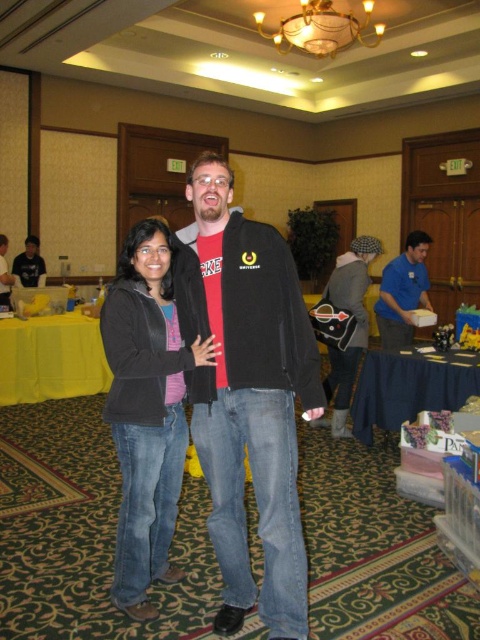
Question: Considering the relative positions of blue shirt at center and matte black jacket at center in the image provided, where is blue shirt at center located with respect to matte black jacket at center?

Choices:
 (A) right
 (B) left

Answer: (A)

Question: Which of the following is the farthest from the observer?

Choices:
 (A) (4, 241)
 (B) (143, 296)
 (C) (24, 371)

Answer: (A)

Question: Among these objects, which one is nearest to the camera?

Choices:
 (A) yellow fabric table at left
 (B) matte black jacket at left
 (C) matte black jacket at center

Answer: (A)

Question: Considering the real-world distances, which object is farthest from the blue shirt at center?

Choices:
 (A) matte black jacket at center
 (B) black matte jacket at center
 (C) black soft jacket at center

Answer: (A)

Question: Is black soft jacket at center thinner than blue fabric table at lower right?

Choices:
 (A) yes
 (B) no

Answer: (A)

Question: Can you confirm if blue shirt at center is bigger than matte black jacket at left?

Choices:
 (A) no
 (B) yes

Answer: (B)